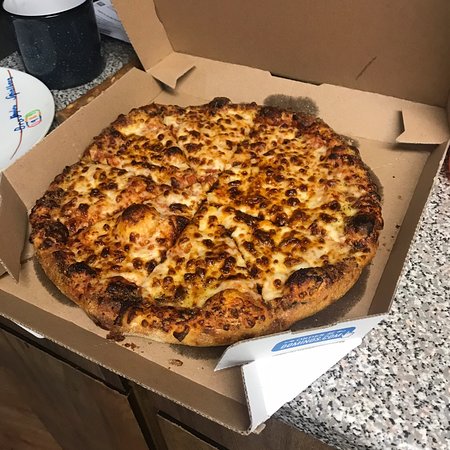
Locate an element on the screen. box is located at coordinates (388, 132).